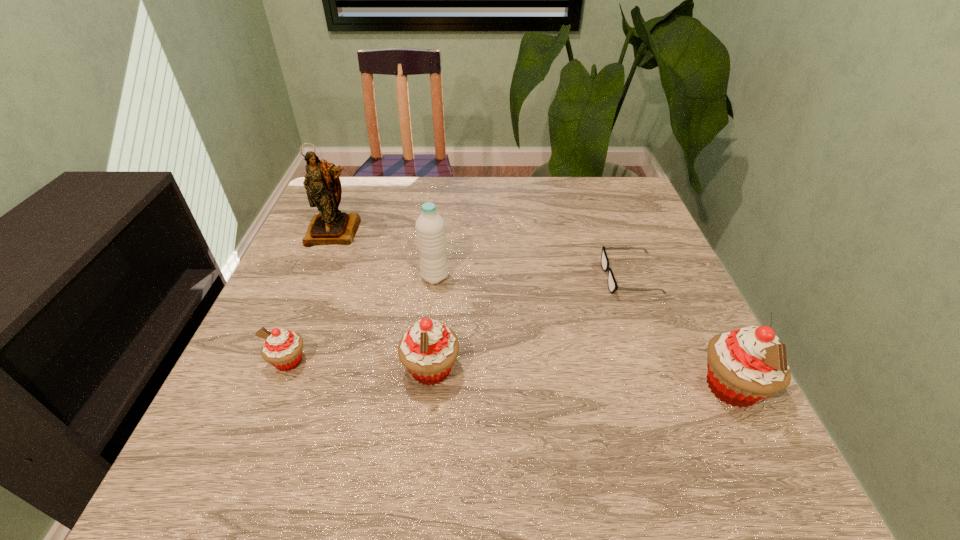
Locate an element on the screen. the shortest cupcake is located at coordinates (282, 348).

The image size is (960, 540). Identify the location of the leftmost cupcake. click(282, 348).

You are a GUI agent. You are given a task and a screenshot of the screen. Output one action in this format:
    pyautogui.click(x=<x>, y=<y>)
    Task: Click on the third shortest object
    
    Given the screenshot: What is the action you would take?
    pyautogui.click(x=428, y=350)

What are the coordinates of `the second cupcake from left to right` in the screenshot? It's located at (428, 350).

This screenshot has height=540, width=960. Find the location of `the rightmost cupcake`. the rightmost cupcake is located at coordinates (747, 365).

This screenshot has width=960, height=540. What are the coordinates of `spectacles` in the screenshot? It's located at (612, 284).

Where is `water bottle`? water bottle is located at coordinates (430, 227).

Where is `figurine`? figurine is located at coordinates (331, 226).

I want to click on the tallest object, so click(x=331, y=226).

Locate an element on the screen. The image size is (960, 540). free space located 0.080m on the front of the leftmost cupcake is located at coordinates (267, 415).